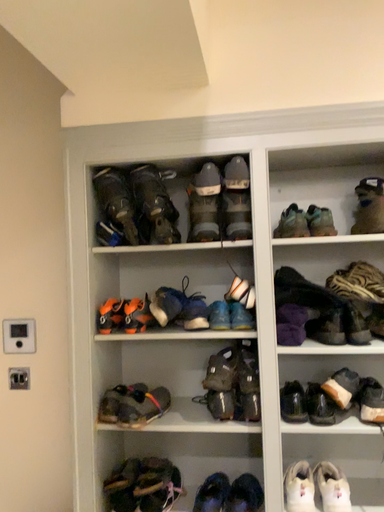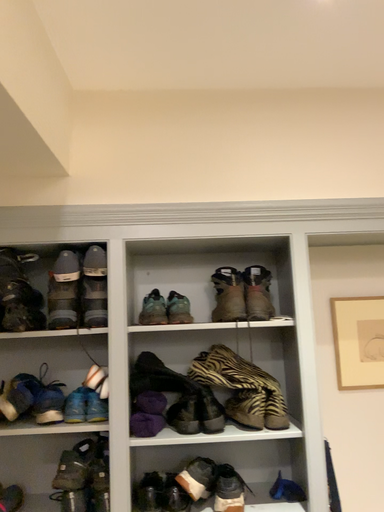
Question: How did the camera likely rotate when shooting the video?

Choices:
 (A) rotated right
 (B) rotated left

Answer: (A)